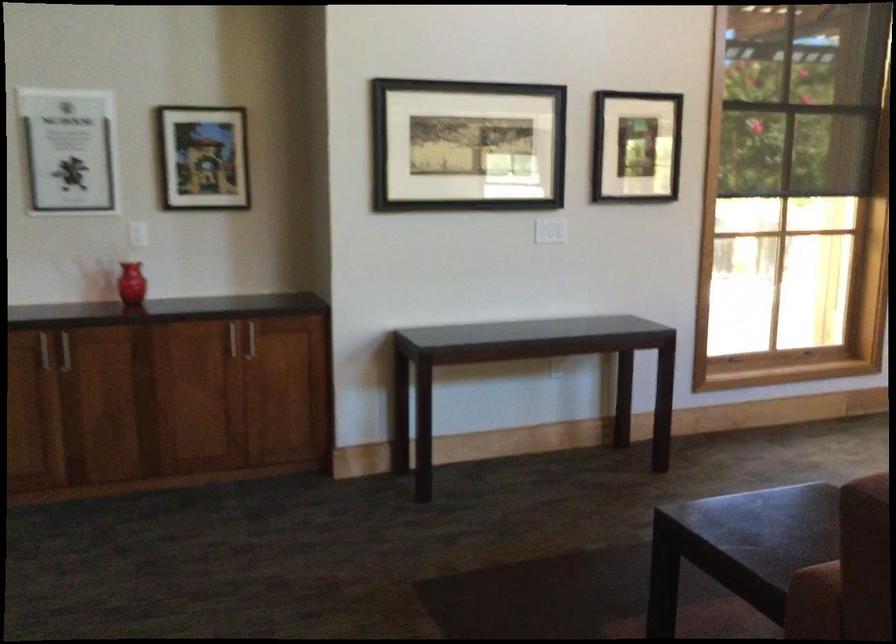
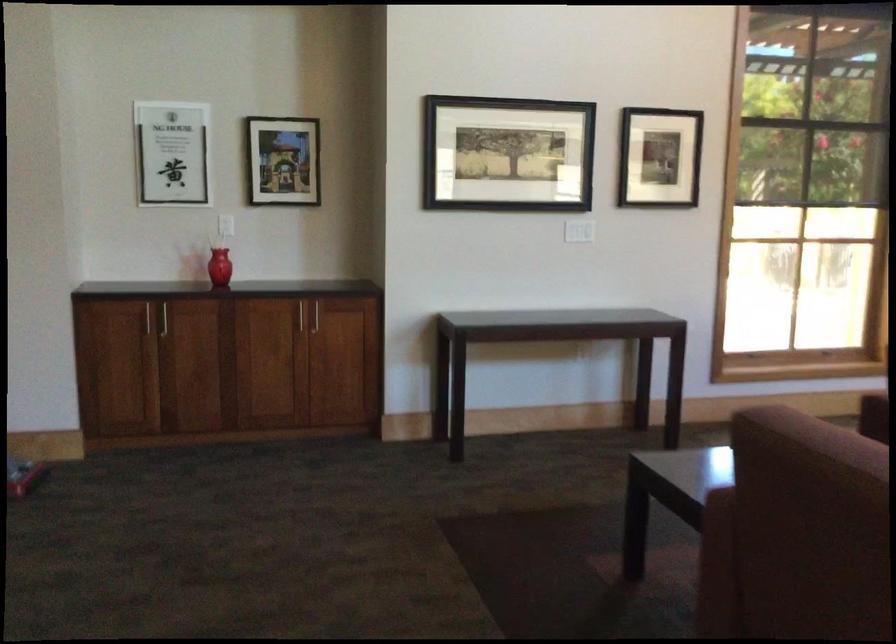
Question: Which direction would the cameraman need to move to produce the second image? Reply with the corresponding letter.

Choices:
 (A) Left
 (B) Right
 (C) Forward
 (D) Backward

Answer: (D)